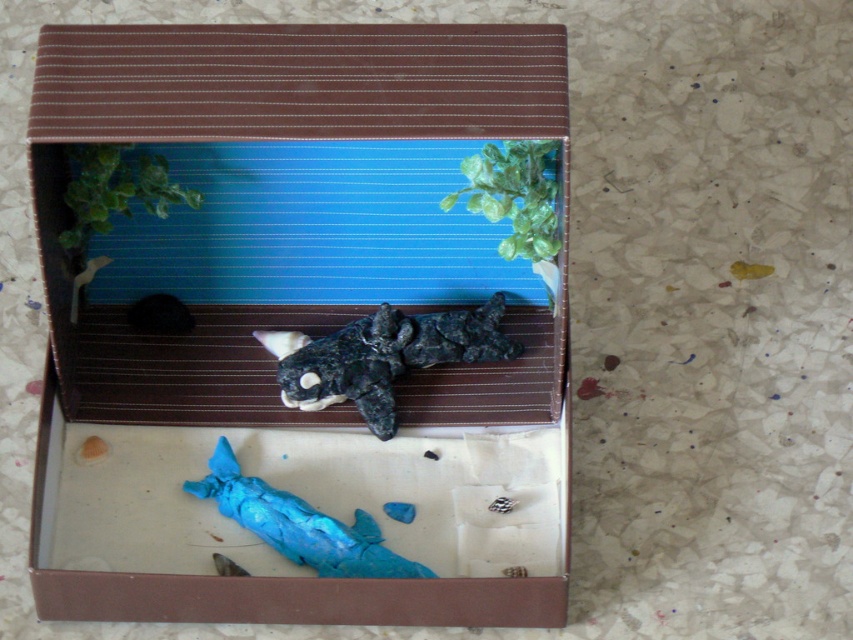
Question: Among these points, which one is farthest from the camera?

Choices:
 (A) (256, 106)
 (B) (434, 339)
 (C) (137, 198)
 (D) (352, 573)

Answer: (B)

Question: Can you confirm if matte black orca at center is positioned to the left of blue clay whale at lower center?

Choices:
 (A) no
 (B) yes

Answer: (A)

Question: Among these points, which one is nearest to the camera?

Choices:
 (A) (346, 380)
 (B) (74, 150)
 (C) (410, 577)
 (D) (311, 189)

Answer: (C)

Question: Which of these objects is positioned farthest from the matte plastic box at center?

Choices:
 (A) blue clay whale at lower center
 (B) green matte plant at upper left

Answer: (B)

Question: Is matte plastic box at center positioned at the back of matte black orca at center?

Choices:
 (A) yes
 (B) no

Answer: (B)

Question: Is matte plastic box at center positioned in front of green matte plant at upper left?

Choices:
 (A) no
 (B) yes

Answer: (B)